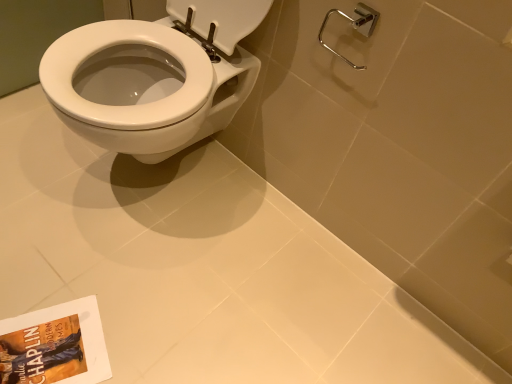
This screenshot has width=512, height=384. In order to click on free space below matte paper book at lower left (from a real-world perspective) in this screenshot , I will do `click(42, 349)`.